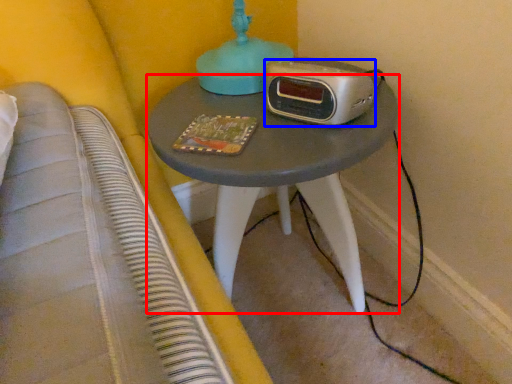
Question: Which of the following is the closest to the observer, nightstand (highlighted by a red box) or stereo (highlighted by a blue box)?

Choices:
 (A) nightstand
 (B) stereo

Answer: (A)